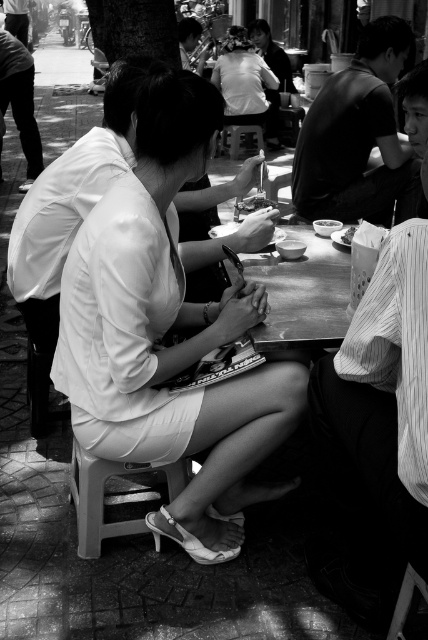
Question: In this image, where is dark gray pants at left located relative to smooth wooden guitar at center?

Choices:
 (A) right
 (B) left

Answer: (B)

Question: Which of these objects is positioned closest to the white matte dress at center?

Choices:
 (A) white plastic stool at lower left
 (B) matte white blouse at center

Answer: (A)

Question: Is white matte dress at center smaller than striped fabric shirt at right?

Choices:
 (A) yes
 (B) no

Answer: (B)

Question: Does smooth black shirt at upper right have a lesser width compared to wooden table at center?

Choices:
 (A) yes
 (B) no

Answer: (B)

Question: Which point is farther to the camera?

Choices:
 (A) matte white blouse at center
 (B) wooden table at center

Answer: (A)

Question: Which of the following is the closest to the observer?

Choices:
 (A) smooth black shirt at upper right
 (B) white paper bag at center

Answer: (B)